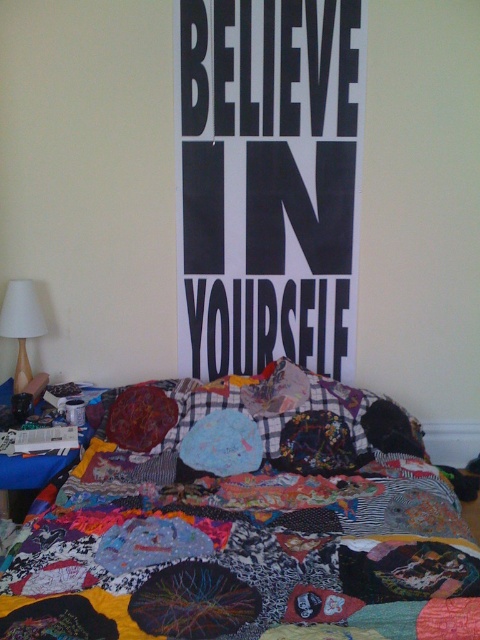
Question: Can you confirm if patchwork quilt at center is positioned to the left of black paper poster at center?

Choices:
 (A) no
 (B) yes

Answer: (B)

Question: Which point appears farthest from the camera in this image?

Choices:
 (A) (323, 152)
 (B) (20, 332)

Answer: (A)

Question: Does patchwork quilt at center appear on the left side of black paper poster at center?

Choices:
 (A) no
 (B) yes

Answer: (B)

Question: Among these points, which one is farthest from the camera?

Choices:
 (A) (16, 314)
 (B) (288, 554)
 (C) (228, 268)

Answer: (C)

Question: Considering the real-world distances, which object is farthest from the black paper poster at center?

Choices:
 (A) patchwork quilt at center
 (B) white fabric lampshade at left

Answer: (B)

Question: Does black paper poster at center appear under white fabric lampshade at left?

Choices:
 (A) no
 (B) yes

Answer: (A)